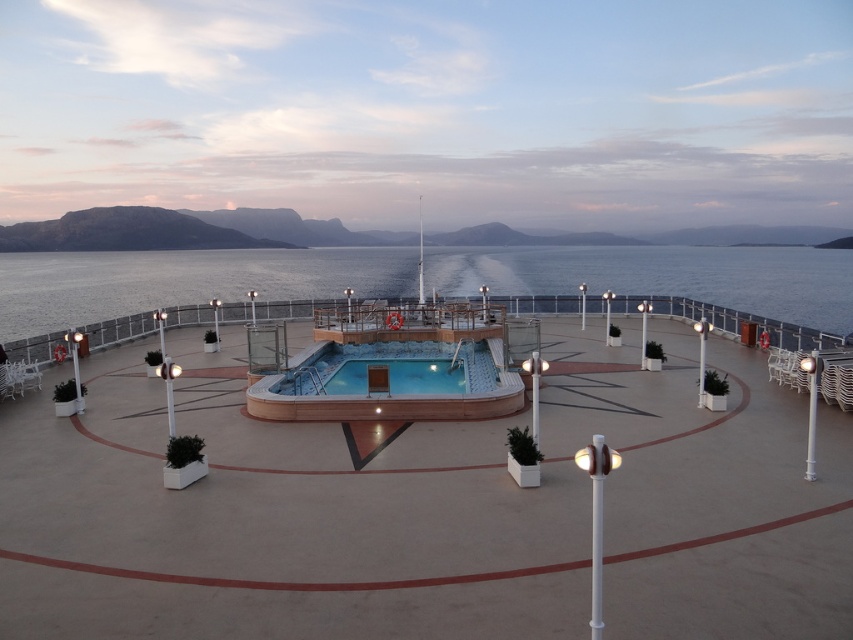
You are planning to host a party on the cruise ship deck. The smooth concrete deck at center and the clear blue water at center are both available. Which area has more space to accommodate more guests?

The clear blue water at center has a larger size compared to the smooth concrete deck at center, so it can accommodate more guests.

You are standing on the cruise ship deck and want to know if you can easily step from the smooth concrete deck at center to the clear blue water at center. Based on their heights, is this possible?

The smooth concrete deck at center has a lesser height compared to the clear blue water at center, so stepping from the smooth concrete deck at center to the clear blue water at center would require climbing upwards since the water is higher.